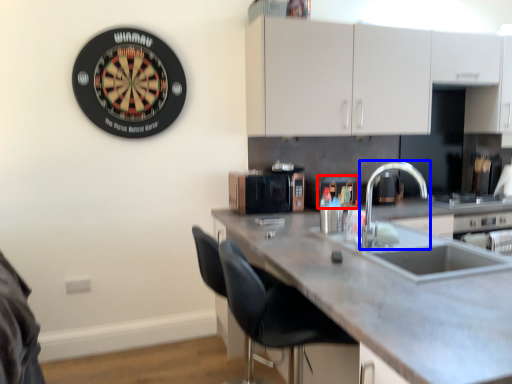
Question: Which object appears farthest to the camera in this image, appliance (highlighted by a red box) or tap (highlighted by a blue box)?

Choices:
 (A) appliance
 (B) tap

Answer: (A)